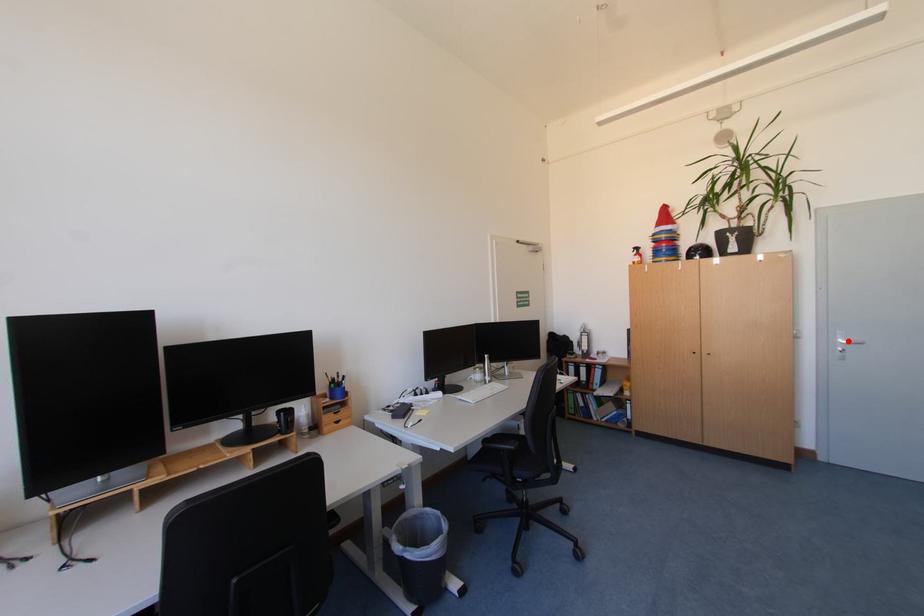
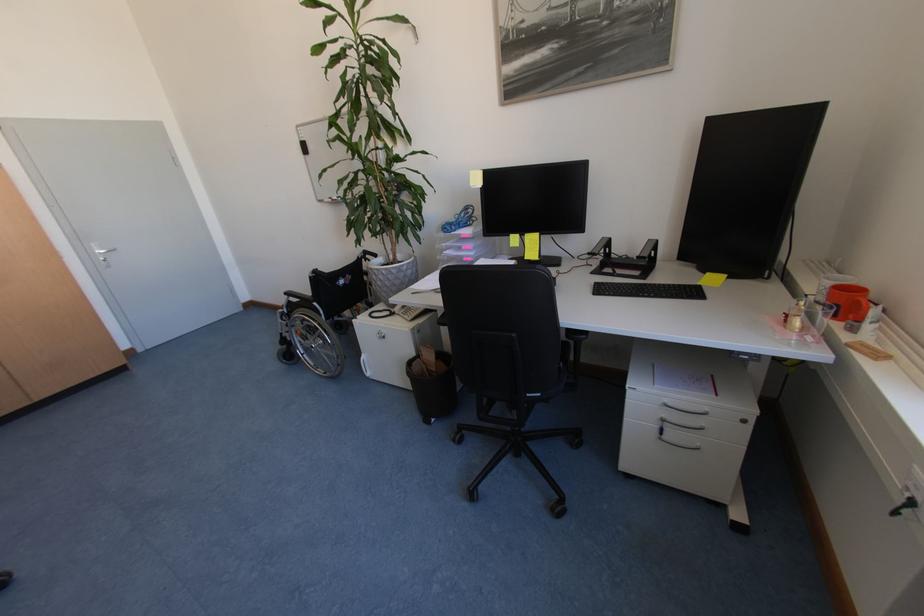
Locate, in the second image, the point that corresponds to the highlighted location in the first image.

(105, 253)